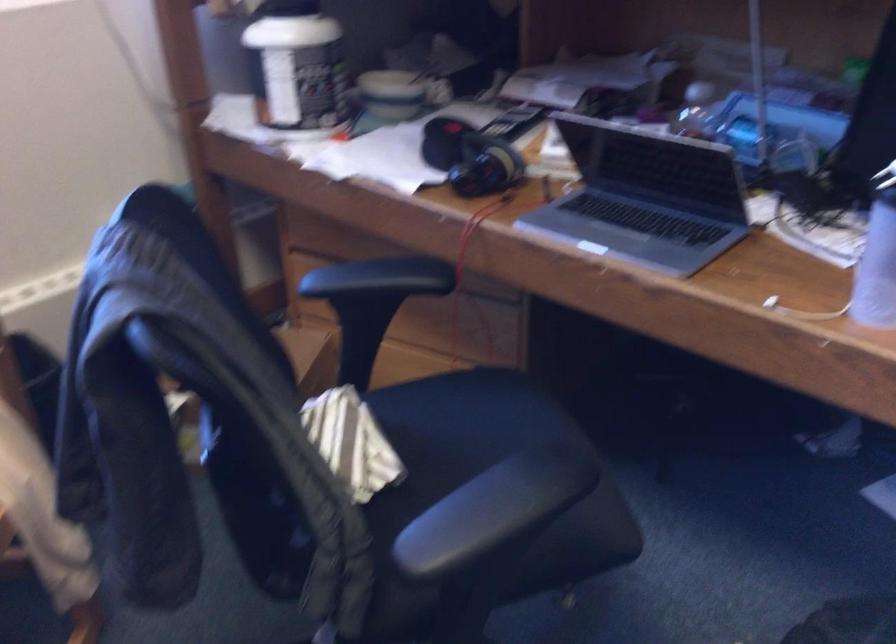
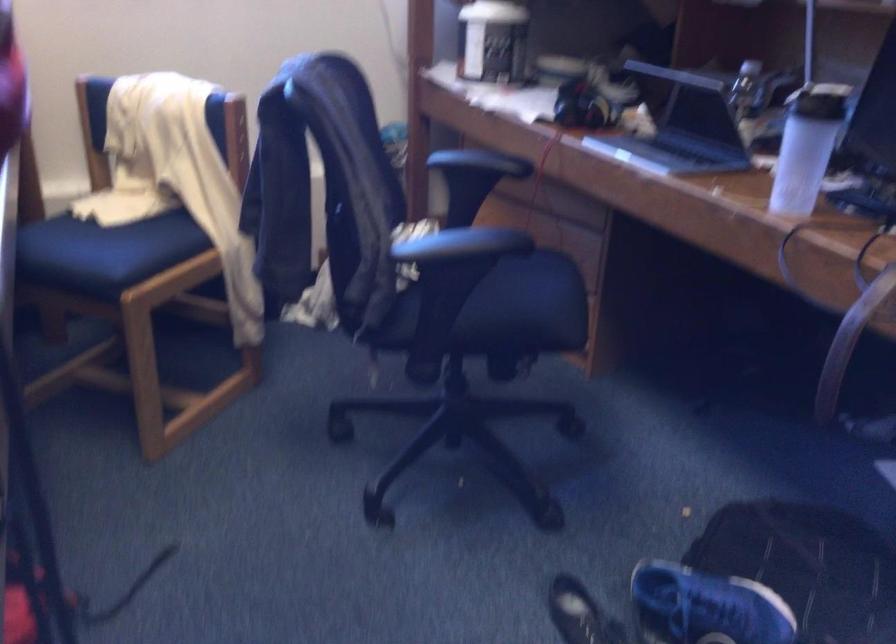
Question: I am providing you with two images of the same scene from different viewpoints. Which of the following objects are not visible in image2?

Choices:
 (A) black chair armrest
 (B) white tumbler
 (C) red spigot handle
 (D) blue chair sitting surface

Answer: (A)